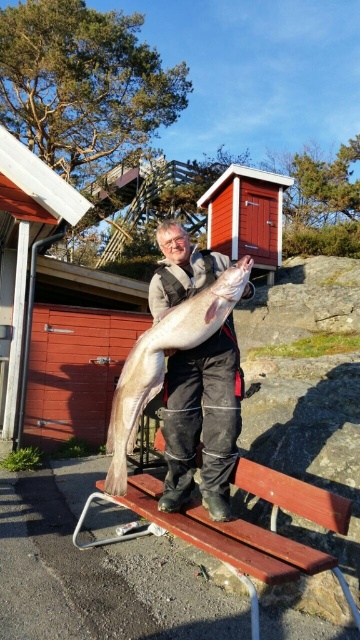
Is wooden bench at center thinner than shiny silver fish at center?

No.

Consider the image. Between wooden bench at center and shiny silver fish at center, which one has more height?

Standing taller between the two is shiny silver fish at center.

Who is more forward, (x=132, y=525) or (x=129, y=384)?

Point (x=129, y=384)

Where is `wooden bench at center`? wooden bench at center is located at coordinates (240, 525).